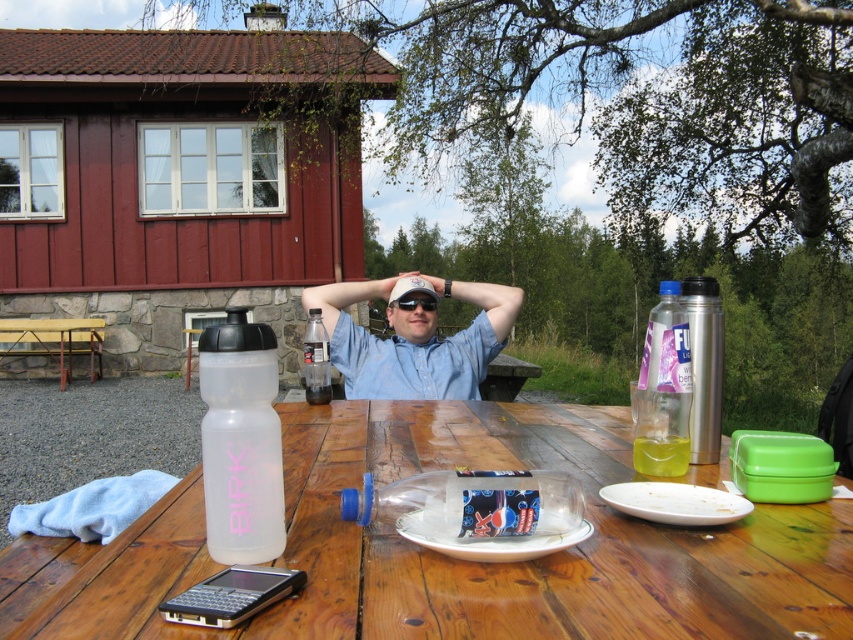
Question: Which object appears farthest from the camera in this image?

Choices:
 (A) translucent plastic bottle at right
 (B) yellow translucent liquid at table center

Answer: (A)

Question: Is transparent plastic water bottle at center-left thinner than translucent plastic bottle at table center?

Choices:
 (A) no
 (B) yes

Answer: (A)

Question: Is transparent plastic water bottle at center-left in front of wooden picnic table at left?

Choices:
 (A) no
 (B) yes

Answer: (B)

Question: Which object appears closest to the camera in this image?

Choices:
 (A) white matte cap at center
 (B) white plastic plate at center
 (C) black plastic goggles at center
 (D) wooden picnic table at left

Answer: (B)

Question: Among these points, which one is farthest from the camera?

Choices:
 (A) (393, 291)
 (B) (636, 460)
 (C) (436, 300)
 (D) (367, 628)

Answer: (A)

Question: Does transparent plastic water bottle at center-left appear under translucent plastic bottle at table center?

Choices:
 (A) yes
 (B) no

Answer: (B)